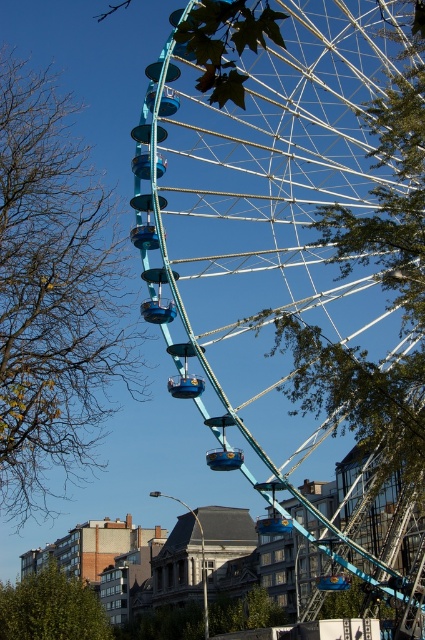
Does teal metallic ferris wheel at center appear on the left side of green leafy tree at lower left?

No, teal metallic ferris wheel at center is not to the left of green leafy tree at lower left.

Is teal metallic ferris wheel at center taller than green leafy tree at lower left?

Indeed, teal metallic ferris wheel at center has a greater height compared to green leafy tree at lower left.

Which is behind, point (200, 262) or point (19, 627)?

The point (200, 262) is more distant.

At what (x,y) coordinates should I click in order to perform the action: click on teal metallic ferris wheel at center. Please return your answer as a coordinate pair (x, y). The height and width of the screenshot is (640, 425). Looking at the image, I should click on (268, 216).

Who is shorter, teal metallic ferris wheel at center or green leafy tree at left?

green leafy tree at left is shorter.

Describe the element at coordinates (268, 216) in the screenshot. The height and width of the screenshot is (640, 425). I see `teal metallic ferris wheel at center` at that location.

Find the location of a particular element. teal metallic ferris wheel at center is located at coordinates (268, 216).

Is green leafy tree at left in front of green leafy tree at lower left?

Yes, it is in front of green leafy tree at lower left.

I want to click on green leafy tree at left, so click(54, 294).

Image resolution: width=425 pixels, height=640 pixels. In order to click on green leafy tree at left in this screenshot , I will do `click(54, 294)`.